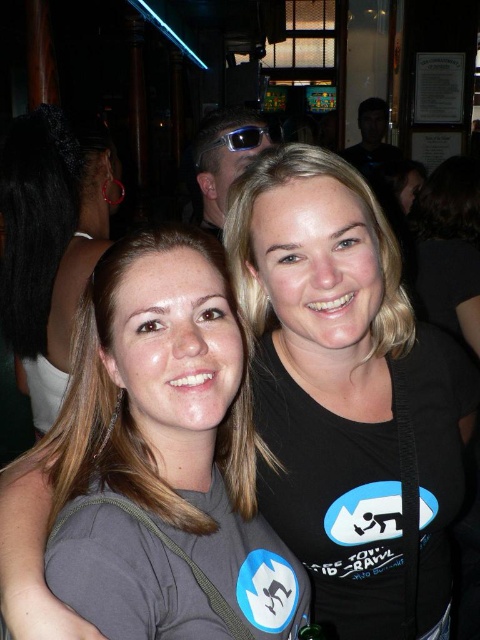
You are a photographer adjusting your camera settings. You want to ensure both the black matte shirt at center and the matte black sunglasses at upper center are in focus. Given the depth of field, if the minimum focus distance your camera can handle is 38 inches, will both objects be in focus?

The distance between the black matte shirt at center and the matte black sunglasses at upper center is 37.99 inches, which is just below the camera minimum focus distance of 38 inches. Therefore, both objects will not be in focus simultaneously.

You are a photographer adjusting the camera settings for a portrait. The gray matte shirt at center and the matte black sunglasses at upper center are both in the frame. Which object is wider?

The gray matte shirt at center is wider than the matte black sunglasses at upper center.

You are a photographer trying to capture a clear shot of the gray matte shirt at center and the matte black sunglasses at upper center. Which object should you focus on to ensure both are in focus?

Since the gray matte shirt at center is in front of the matte black sunglasses at upper center, you should focus on the gray matte shirt at center to ensure both are in focus.